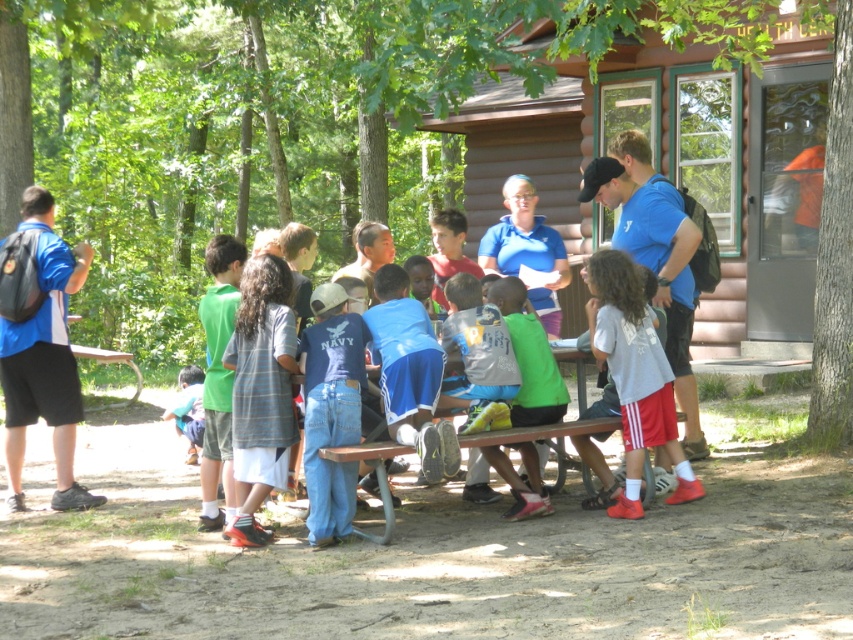
Does white cotton shirt at center have a lesser width compared to brown wooden picnic table at center?

Incorrect, white cotton shirt at center's width is not less than brown wooden picnic table at center's.

Does white cotton shirt at center have a greater height compared to brown wooden picnic table at center?

Correct, white cotton shirt at center is much taller as brown wooden picnic table at center.

Which is behind, point (624, 397) or point (364, 444)?

The point (624, 397) is more distant.

Locate an element on the screen. This screenshot has height=640, width=853. white cotton shirt at center is located at coordinates (634, 376).

Based on the photo, is striped cotton shirt at center closer to camera compared to denim jeans at center?

No, striped cotton shirt at center is behind denim jeans at center.

The image size is (853, 640). What are the coordinates of `striped cotton shirt at center` in the screenshot? It's located at [260, 390].

Is point (271, 381) closer to camera compared to point (328, 531)?

No, it is not.

The height and width of the screenshot is (640, 853). Find the location of `striped cotton shirt at center`. striped cotton shirt at center is located at coordinates (260, 390).

Can you confirm if white cotton shirt at center is positioned to the right of green fabric shirt at lower left?

Indeed, white cotton shirt at center is positioned on the right side of green fabric shirt at lower left.

Is point (643, 310) farther from viewer compared to point (196, 436)?

No.

At what (x,y) coordinates should I click in order to perform the action: click on white cotton shirt at center. Please return your answer as a coordinate pair (x, y). Looking at the image, I should click on (634, 376).